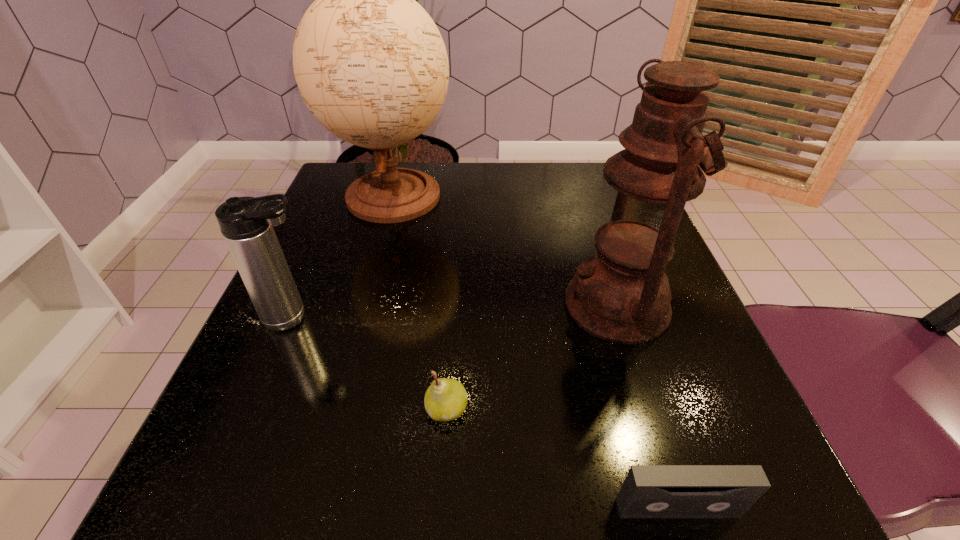
Where is `the farthest object`? the farthest object is located at coordinates (370, 64).

Identify the location of globe. (370, 64).

This screenshot has height=540, width=960. I want to click on the fourth shortest object, so click(621, 294).

Where is `the third shortest object`? the third shortest object is located at coordinates (246, 223).

Where is `pear`? This screenshot has height=540, width=960. pear is located at coordinates (445, 400).

Where is `videotape`? videotape is located at coordinates (649, 491).

The image size is (960, 540). I want to click on vacant area situated 0.100m on the surface of the farthest object, so click(374, 269).

In order to click on vacant point located on the left of the oil lamp in this screenshot , I will do `click(385, 305)`.

You are a GUI agent. You are given a task and a screenshot of the screen. Output one action in this format:
    pyautogui.click(x=<x>, y=<y>)
    Task: Click on the vacant space situated on the handle side of the third tallest object
    
    Given the screenshot: What is the action you would take?
    pyautogui.click(x=541, y=318)

Where is `vacant point located 0.220m on the right of the pear`? vacant point located 0.220m on the right of the pear is located at coordinates (632, 409).